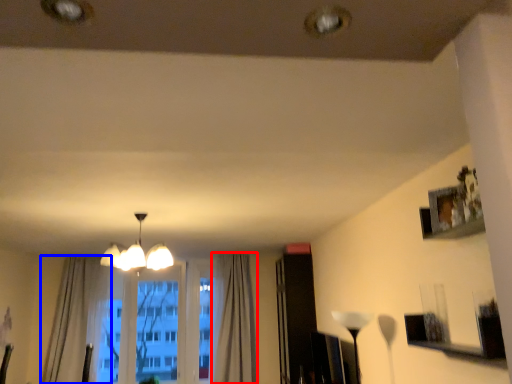
Question: Among these objects, which one is farthest to the camera, curtain (highlighted by a red box) or curtain (highlighted by a blue box)?

Choices:
 (A) curtain
 (B) curtain

Answer: (A)